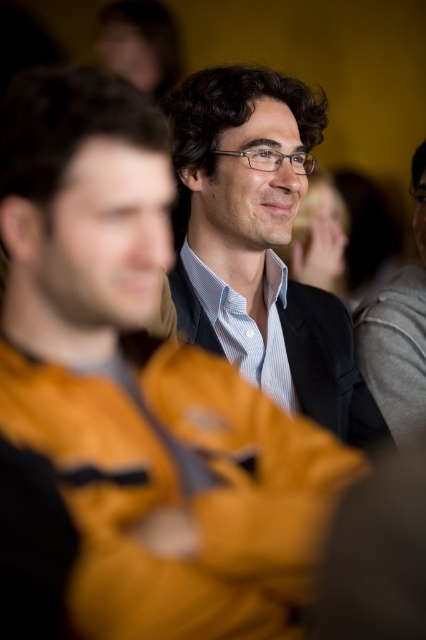
Does point (302, 164) lie in front of point (425, 177)?

That is True.

Does matte black suit at center have a lesser width compared to gray wool sweater at right?

No.

What do you see at coordinates (259, 244) in the screenshot?
I see `matte black suit at center` at bounding box center [259, 244].

This screenshot has width=426, height=640. In order to click on matte black suit at center in this screenshot , I will do `click(259, 244)`.